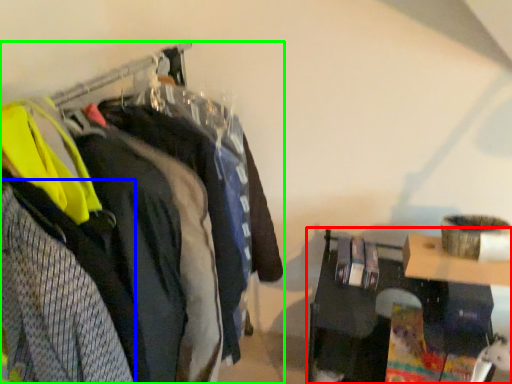
Question: Which object is the closest to the furniture (highlighted by a red box)? Choose among these: clothing (highlighted by a blue box) or closet (highlighted by a green box).

Choices:
 (A) clothing
 (B) closet

Answer: (B)